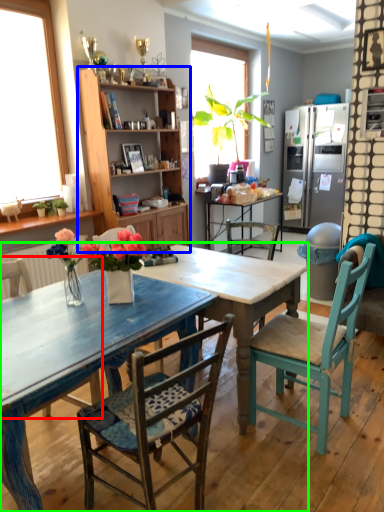
Question: Based on their relative distances, which object is farther from chair (highlighted by a red box)? Choose from cabinetry (highlighted by a blue box) and kitchen & dining room table (highlighted by a green box).

Choices:
 (A) cabinetry
 (B) kitchen & dining room table

Answer: (A)